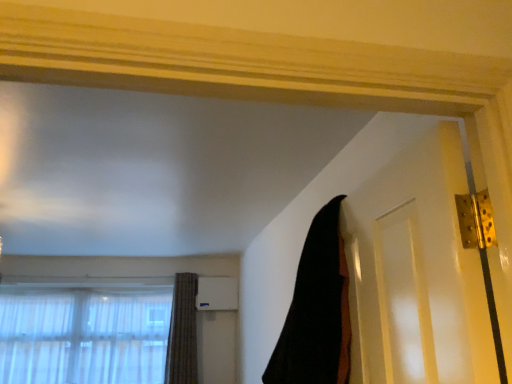
What do you see at coordinates (182, 332) in the screenshot?
I see `textured brown curtain at lower left, the first curtain when ordered from bottom to top` at bounding box center [182, 332].

Find the location of `black fabric at upper right, the 2th curtain viewed from the left`. black fabric at upper right, the 2th curtain viewed from the left is located at coordinates (317, 310).

This screenshot has height=384, width=512. I want to click on translucent fabric at lower left, so click(x=83, y=333).

Is textured brown curtain at lower left, which ranks as the second curtain in top-to-bottom order, in contact with translucent fabric at lower left?

No.

Is textured brown curtain at lower left, arranged as the 1th curtain when viewed from the left, bigger or smaller than translucent fabric at lower left?

textured brown curtain at lower left, arranged as the 1th curtain when viewed from the left, is smaller than translucent fabric at lower left.

Which of these two, textured brown curtain at lower left, which appears as the first curtain when viewed from the back, or translucent fabric at lower left, is wider?

Wider between the two is textured brown curtain at lower left, which appears as the first curtain when viewed from the back.

Can you confirm if textured brown curtain at lower left, the second curtain from the front, is positioned to the right of translucent fabric at lower left?

Yes.

Is black fabric at upper right, the 2th curtain viewed from the left, directly adjacent to translucent fabric at lower left?

black fabric at upper right, the 2th curtain viewed from the left, and translucent fabric at lower left are not in contact.

From a real-world perspective, is black fabric at upper right, positioned as the first curtain in top-to-bottom order, positioned above or below translucent fabric at lower left?

From a real-world perspective, black fabric at upper right, positioned as the first curtain in top-to-bottom order, is physically above translucent fabric at lower left.

Would you say black fabric at upper right, the 1th curtain from the front, is inside or outside translucent fabric at lower left?

black fabric at upper right, the 1th curtain from the front, cannot be found inside translucent fabric at lower left.

Between black fabric at upper right, positioned as the first curtain in top-to-bottom order, and translucent fabric at lower left, which one has less height?

black fabric at upper right, positioned as the first curtain in top-to-bottom order, is shorter.

Which point is more distant from viewer, (x=164, y=329) or (x=331, y=370)?

Positioned behind is point (x=164, y=329).

Is translucent fabric at lower left taller than black fabric at upper right, marked as the 2th curtain in a bottom-to-top arrangement?

Yes.

Which is more to the left, translucent fabric at lower left or black fabric at upper right, which is counted as the 2th curtain, starting from the back?

translucent fabric at lower left.

Between translucent fabric at lower left and black fabric at upper right, which is counted as the 2th curtain, starting from the back, which one is positioned in front?

black fabric at upper right, which is counted as the 2th curtain, starting from the back, is more forward.

Is black fabric at upper right, marked as the 2th curtain in a bottom-to-top arrangement, facing away from textured brown curtain at lower left, the first curtain when ordered from bottom to top?

No, textured brown curtain at lower left, the first curtain when ordered from bottom to top, is not at the back of black fabric at upper right, marked as the 2th curtain in a bottom-to-top arrangement.

Does point (314, 342) appear closer or farther from the camera than point (194, 359)?

Point (314, 342).

Considering the relative positions of black fabric at upper right, positioned as the first curtain in top-to-bottom order, and textured brown curtain at lower left, the 2th curtain viewed from the right, in the image provided, is black fabric at upper right, positioned as the first curtain in top-to-bottom order, behind textured brown curtain at lower left, the 2th curtain viewed from the right,?

No, it is in front of textured brown curtain at lower left, the 2th curtain viewed from the right.

Looking at this image, is translucent fabric at lower left positioned in front of textured brown curtain at lower left, arranged as the 1th curtain when viewed from the left?

Yes, it is.

Between translucent fabric at lower left and textured brown curtain at lower left, arranged as the 1th curtain when viewed from the left, which one has smaller size?

textured brown curtain at lower left, arranged as the 1th curtain when viewed from the left, is smaller.

Based on the photo, from a real-world perspective, who is located lower, translucent fabric at lower left or textured brown curtain at lower left, which appears as the first curtain when viewed from the back?

translucent fabric at lower left, from a real-world perspective.

Locate an element on the screen. The image size is (512, 384). curtain that is under the black fabric at upper right, marked as the 2th curtain in a bottom-to-top arrangement (from a real-world perspective) is located at coordinates (182, 332).

Is point (185, 317) more distant than point (281, 357)?

Yes, point (185, 317) is farther from viewer.

Are textured brown curtain at lower left, which appears as the first curtain when viewed from the back, and black fabric at upper right, marked as the 2th curtain in a bottom-to-top arrangement, far apart?

Yes, textured brown curtain at lower left, which appears as the first curtain when viewed from the back, and black fabric at upper right, marked as the 2th curtain in a bottom-to-top arrangement, are quite far apart.

From the image's perspective, which is below, textured brown curtain at lower left, which ranks as the second curtain in top-to-bottom order, or black fabric at upper right, the 1th curtain from the front?

textured brown curtain at lower left, which ranks as the second curtain in top-to-bottom order, from the image's perspective.

Where is `window below the textured brown curtain at lower left, which appears as the first curtain when viewed from the back (from the image's perspective)`? window below the textured brown curtain at lower left, which appears as the first curtain when viewed from the back (from the image's perspective) is located at coordinates (83, 333).

At what (x,y) coordinates should I click in order to perform the action: click on the 2nd curtain directly above the translucent fabric at lower left (from a real-world perspective). Please return your answer as a coordinate pair (x, y). Looking at the image, I should click on (317, 310).

Looking at the image, which one is located further to translucent fabric at lower left, textured brown curtain at lower left, which appears as the first curtain when viewed from the back, or black fabric at upper right, positioned as the first curtain in top-to-bottom order?

black fabric at upper right, positioned as the first curtain in top-to-bottom order, is positioned further to the anchor translucent fabric at lower left.

Consider the image. Looking at the image, which one is located closer to textured brown curtain at lower left, the second curtain from the front, black fabric at upper right, positioned as the first curtain in right-to-left order, or translucent fabric at lower left?

translucent fabric at lower left is positioned closer to the anchor textured brown curtain at lower left, the second curtain from the front.

Based on their spatial positions, is textured brown curtain at lower left, which ranks as the second curtain in top-to-bottom order, or translucent fabric at lower left closer to black fabric at upper right, the 2th curtain viewed from the left?

textured brown curtain at lower left, which ranks as the second curtain in top-to-bottom order, is closer to black fabric at upper right, the 2th curtain viewed from the left.

When comparing their distances from black fabric at upper right, positioned as the first curtain in top-to-bottom order, does translucent fabric at lower left or textured brown curtain at lower left, arranged as the 1th curtain when viewed from the left, seem further?

translucent fabric at lower left is further to black fabric at upper right, positioned as the first curtain in top-to-bottom order.

Considering their positions, is translucent fabric at lower left positioned further to textured brown curtain at lower left, the second curtain from the front, than black fabric at upper right, the 2th curtain viewed from the left?

Based on the image, black fabric at upper right, the 2th curtain viewed from the left, appears to be further to textured brown curtain at lower left, the second curtain from the front.

When comparing their distances from translucent fabric at lower left, does black fabric at upper right, positioned as the first curtain in top-to-bottom order, or textured brown curtain at lower left, which appears as the first curtain when viewed from the back, seem closer?

Based on the image, textured brown curtain at lower left, which appears as the first curtain when viewed from the back, appears to be nearer to translucent fabric at lower left.

Where is `window positioned between black fabric at upper right, marked as the 2th curtain in a bottom-to-top arrangement, and textured brown curtain at lower left, the second curtain from the front, from near to far`? window positioned between black fabric at upper right, marked as the 2th curtain in a bottom-to-top arrangement, and textured brown curtain at lower left, the second curtain from the front, from near to far is located at coordinates (83, 333).